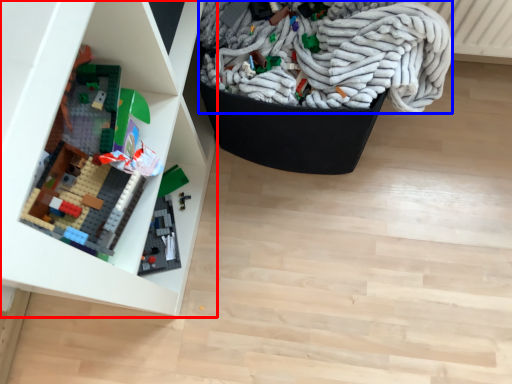
Question: Which of the following is the farthest to the observer, shelf (highlighted by a red box) or wrap (highlighted by a blue box)?

Choices:
 (A) shelf
 (B) wrap

Answer: (B)